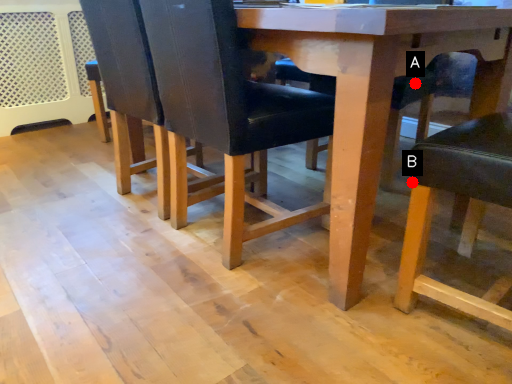
Question: Two points are circled on the image, labeled by A and B beside each circle. Which of the following is the closest to the observer?

Choices:
 (A) A is closer
 (B) B is closer

Answer: (B)